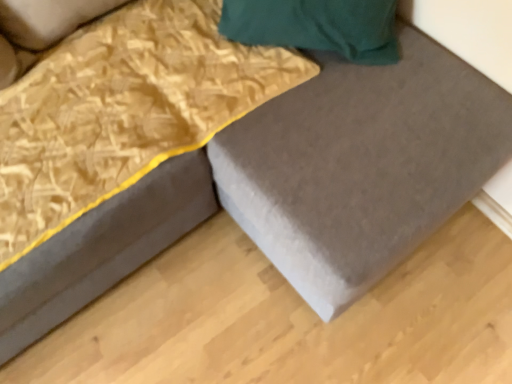
Question: Relative to gold textured blanket at upper left, is matte gray bed frame at lower left in front or behind?

Choices:
 (A) behind
 (B) front

Answer: (B)

Question: From the image's perspective, is matte gray bed frame at lower left located above or below gold textured blanket at upper left?

Choices:
 (A) below
 (B) above

Answer: (A)

Question: Which is farther from the matte gray bed frame at lower left?

Choices:
 (A) gold textured blanket at upper left
 (B) matte gray plywood at lower right

Answer: (B)

Question: Which object is positioned closest to the matte gray plywood at lower right?

Choices:
 (A) gold textured blanket at upper left
 (B) matte gray bed frame at lower left

Answer: (B)